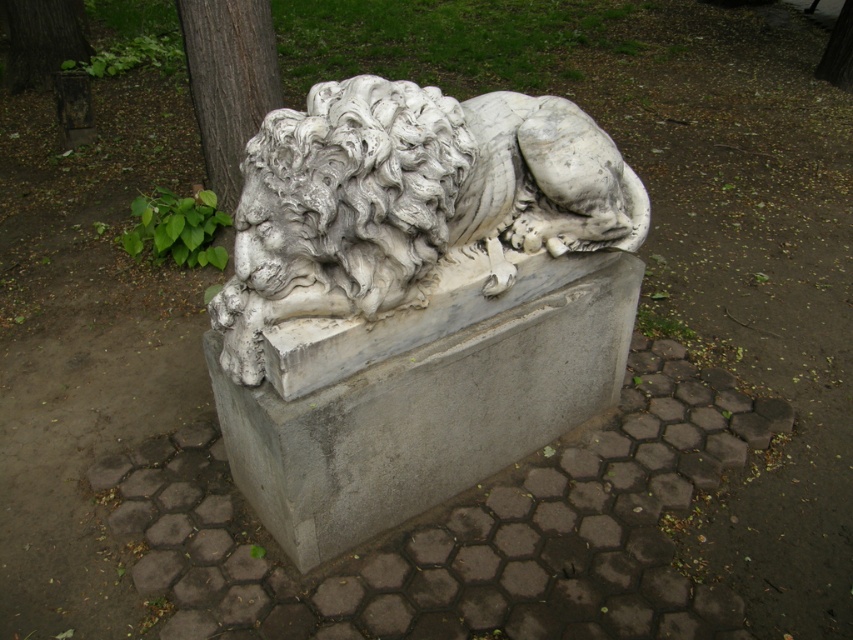
In the scene shown: Between gray concrete at center and white marble lion head at center, which one has more height?

With more height is gray concrete at center.

Does gray concrete at center have a lesser width compared to white marble lion head at center?

Incorrect, gray concrete at center's width is not less than white marble lion head at center's.

The width and height of the screenshot is (853, 640). I want to click on gray concrete at center, so click(x=424, y=416).

Does white marble lion head at center lie behind smooth bark tree at upper left?

No, white marble lion head at center is in front of smooth bark tree at upper left.

Where is `white marble lion head at center`? white marble lion head at center is located at coordinates (306, 204).

The height and width of the screenshot is (640, 853). Find the location of `white marble lion head at center`. white marble lion head at center is located at coordinates (306, 204).

Can you confirm if gray concrete at center is bigger than smooth bark tree at upper left?

Yes.

Does gray concrete at center appear over smooth bark tree at upper left?

Incorrect, gray concrete at center is not positioned above smooth bark tree at upper left.

The width and height of the screenshot is (853, 640). In order to click on gray concrete at center in this screenshot , I will do `click(424, 416)`.

Identify the location of gray concrete at center. (424, 416).